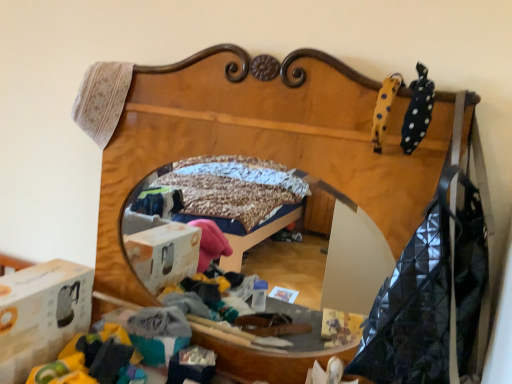
Question: In the image, is black dotted fabric at upper right positioned in front of or behind white cardboard box at lower left?

Choices:
 (A) front
 (B) behind

Answer: (A)

Question: Considering the positions of black dotted fabric at upper right and white cardboard box at lower left in the image, is black dotted fabric at upper right wider or thinner than white cardboard box at lower left?

Choices:
 (A) wide
 (B) thin

Answer: (B)

Question: Estimate the real-world distances between objects in this image. Which object is closer to the wooden bed frame at center?

Choices:
 (A) yellow dotted plush at upper right
 (B) black dotted fabric at upper right
 (C) white cardboard box at lower left

Answer: (A)

Question: Which is farther from the yellow dotted plush at upper right?

Choices:
 (A) black dotted fabric at upper right
 (B) wooden bed frame at center
 (C) white cardboard box at lower left

Answer: (C)